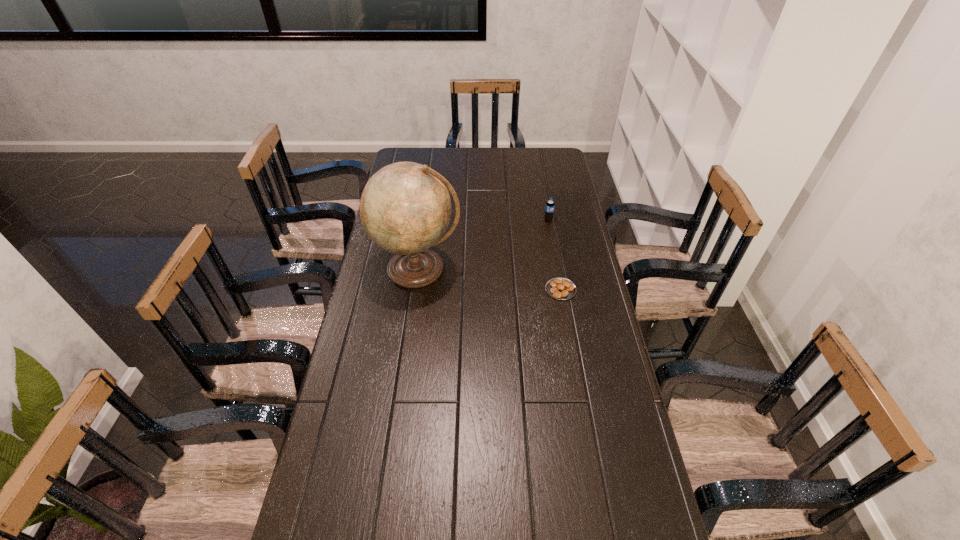
Locate an element on the screen. the tallest object is located at coordinates click(x=405, y=208).

Where is `globe`? globe is located at coordinates (405, 208).

Locate an element on the screen. This screenshot has height=540, width=960. soda bottle is located at coordinates 550,205.

In order to click on the second shortest object in this screenshot , I will do `click(550, 205)`.

The width and height of the screenshot is (960, 540). Identify the location of pastry. (559, 288).

This screenshot has height=540, width=960. What are the coordinates of `vacant area situated 0.400m on the front-facing side of the tallest object` in the screenshot? It's located at 399,404.

Find the location of a particular element. vacant region located 0.130m on the front of the second tallest object is located at coordinates (552, 244).

The image size is (960, 540). I want to click on free region located 0.100m on the back of the shortest object, so click(555, 260).

Identify the location of object that is at the left edge. (405, 208).

Find the location of `soda bottle at the right edge`. soda bottle at the right edge is located at coordinates (550, 205).